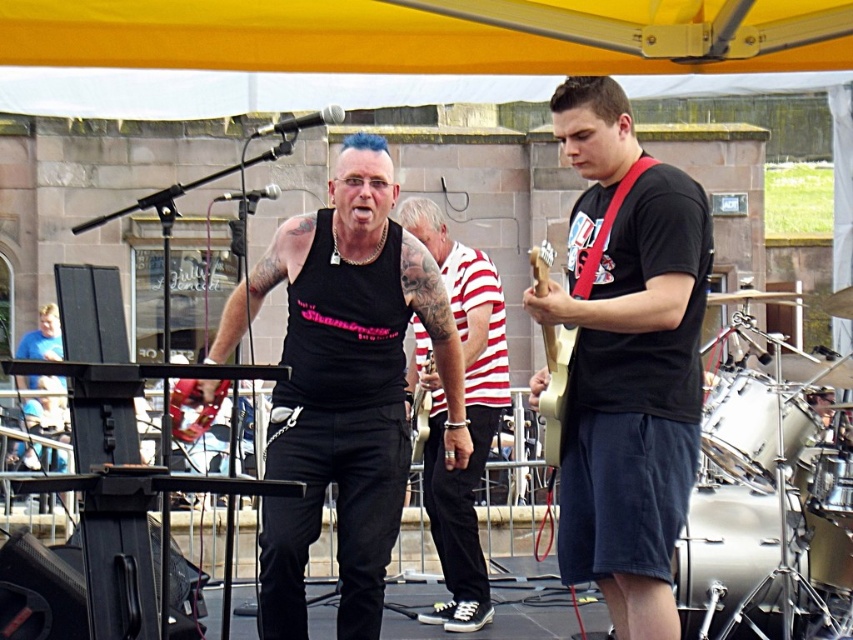
Question: Is black matte tank top at center bigger than white drum at right?

Choices:
 (A) yes
 (B) no

Answer: (A)

Question: Which point is farther to the camera?

Choices:
 (A) matte black t-shirt at center
 (B) white drum at right

Answer: (B)

Question: In this image, where is white drum at right located relative to matte black tank top at center?

Choices:
 (A) above
 (B) below

Answer: (A)

Question: Which point is closer to the camera taking this photo?

Choices:
 (A) (444, 426)
 (B) (763, 541)
 (C) (352, 138)
 (D) (822, 452)

Answer: (D)

Question: Which is nearer to the wooden acoustic guitar at center?

Choices:
 (A) brushed metal drum at lower right
 (B) white drum at right

Answer: (A)

Question: Is matte black t-shirt at center closer to the viewer compared to matte black tank top at center?

Choices:
 (A) no
 (B) yes

Answer: (B)